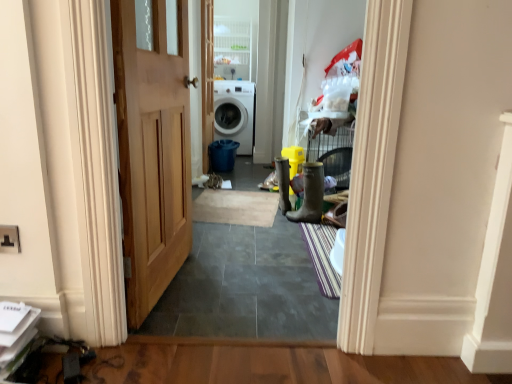
Where is `vacant area on the back side of wooden door at left`? vacant area on the back side of wooden door at left is located at coordinates (220, 248).